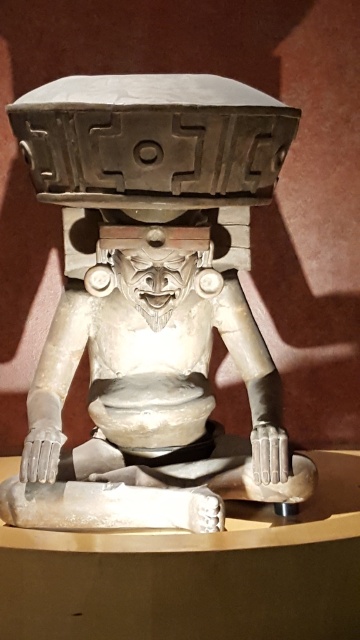
Identify the location of white matte sculpture at center. This screenshot has height=640, width=360. (150, 298).

Is white matte sculpture at center smaller than white stone carving at center?

Actually, white matte sculpture at center might be larger than white stone carving at center.

The width and height of the screenshot is (360, 640). Describe the element at coordinates (150, 298) in the screenshot. I see `white matte sculpture at center` at that location.

This screenshot has height=640, width=360. Identify the location of white matte sculpture at center. (150, 298).